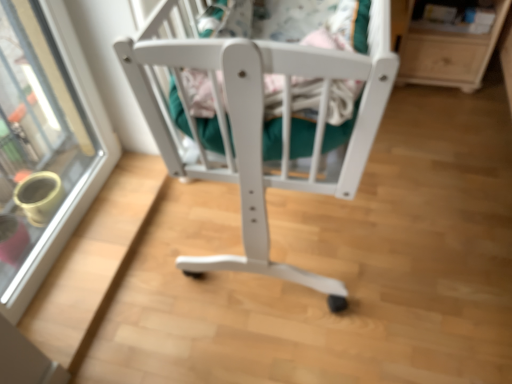
Question: From a real-world perspective, is transparent glass door at upper left under light wood/texture shelf at upper right?

Choices:
 (A) yes
 (B) no

Answer: (B)

Question: Considering the relative positions of transparent glass door at upper left and light wood/texture shelf at upper right in the image provided, is transparent glass door at upper left to the left of light wood/texture shelf at upper right from the viewer's perspective?

Choices:
 (A) no
 (B) yes

Answer: (B)

Question: Is transparent glass door at upper left aimed at light wood/texture shelf at upper right?

Choices:
 (A) no
 (B) yes

Answer: (A)

Question: From the image's perspective, is transparent glass door at upper left on light wood/texture shelf at upper right?

Choices:
 (A) yes
 (B) no

Answer: (B)

Question: Is transparent glass door at upper left directly adjacent to light wood/texture shelf at upper right?

Choices:
 (A) yes
 (B) no

Answer: (B)

Question: Is transparent glass door at upper left inside the boundaries of light wood/texture shelf at upper right, or outside?

Choices:
 (A) inside
 (B) outside

Answer: (B)

Question: In the image, is transparent glass door at upper left on the left side or the right side of light wood/texture shelf at upper right?

Choices:
 (A) right
 (B) left

Answer: (B)

Question: From the image's perspective, relative to light wood/texture shelf at upper right, is transparent glass door at upper left above or below?

Choices:
 (A) below
 (B) above

Answer: (A)

Question: Looking at their shapes, would you say transparent glass door at upper left is wider or thinner than light wood/texture shelf at upper right?

Choices:
 (A) wide
 (B) thin

Answer: (B)

Question: Considering their positions, is light wood/texture shelf at upper right located in front of or behind transparent glass door at upper left?

Choices:
 (A) front
 (B) behind

Answer: (B)

Question: Looking at the image, does light wood/texture shelf at upper right seem bigger or smaller compared to transparent glass door at upper left?

Choices:
 (A) big
 (B) small

Answer: (B)

Question: From a real-world perspective, is light wood/texture shelf at upper right physically located above or below transparent glass door at upper left?

Choices:
 (A) below
 (B) above

Answer: (A)

Question: Which is correct: light wood/texture shelf at upper right is inside transparent glass door at upper left, or outside of it?

Choices:
 (A) inside
 (B) outside

Answer: (B)

Question: Is transparent glass door at upper left wider or thinner than white wood crib at center?

Choices:
 (A) thin
 (B) wide

Answer: (A)

Question: In the image, is transparent glass door at upper left positioned in front of or behind white wood crib at center?

Choices:
 (A) front
 (B) behind

Answer: (A)